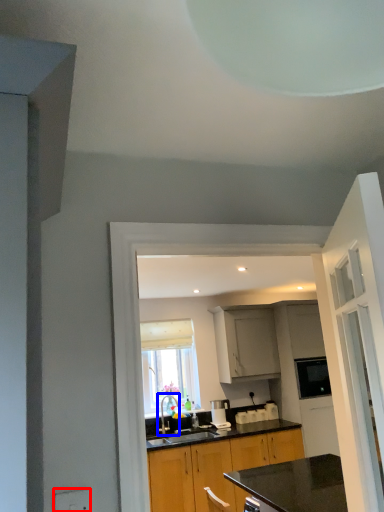
Question: Which of the following is the closest to the observer, electric outlet (highlighted by a red box) or tap (highlighted by a blue box)?

Choices:
 (A) electric outlet
 (B) tap

Answer: (A)